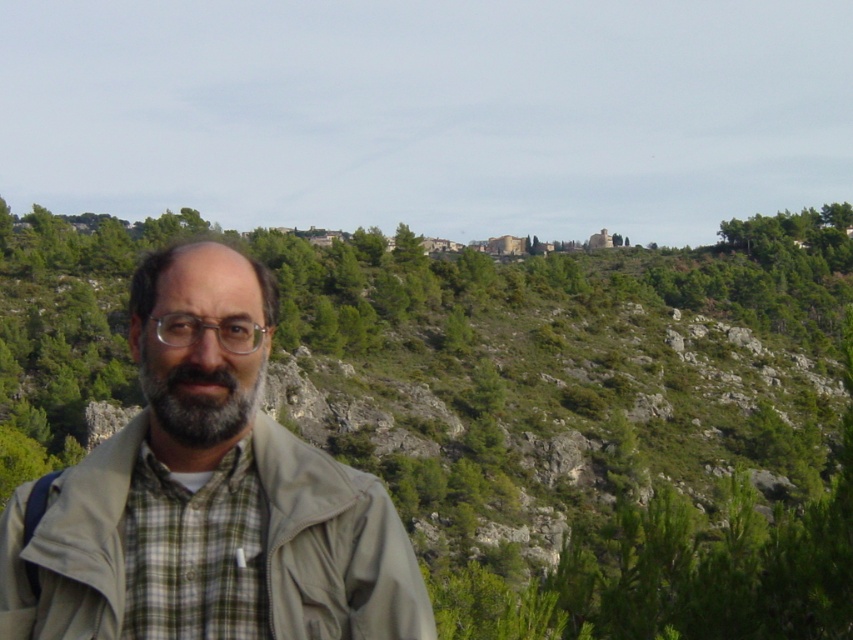
Question: Is green plaid shirt at center smaller than gray matte beard at center?

Choices:
 (A) no
 (B) yes

Answer: (A)

Question: Does green leafy tree at center have a larger size compared to green plaid shirt at center?

Choices:
 (A) no
 (B) yes

Answer: (B)

Question: Which object is the farthest from the gray matte beard at center?

Choices:
 (A) green plaid shirt at center
 (B) green leafy tree at center
 (C) beige fabric jacket at center

Answer: (B)

Question: Which of the following is the farthest from the observer?

Choices:
 (A) beige fabric jacket at center
 (B) green leafy tree at center
 (C) green plaid shirt at center
 (D) gray matte beard at center

Answer: (B)

Question: Which of these objects is positioned closest to the gray matte beard at center?

Choices:
 (A) green plaid shirt at center
 (B) beige fabric jacket at center
 (C) green leafy tree at center

Answer: (B)

Question: Can you confirm if green leafy tree at center is wider than gray matte beard at center?

Choices:
 (A) yes
 (B) no

Answer: (A)